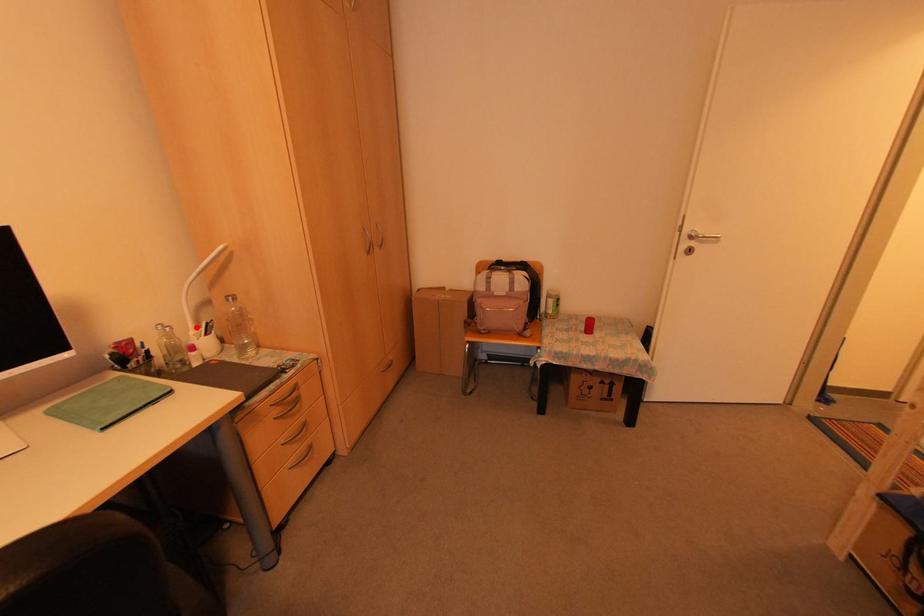
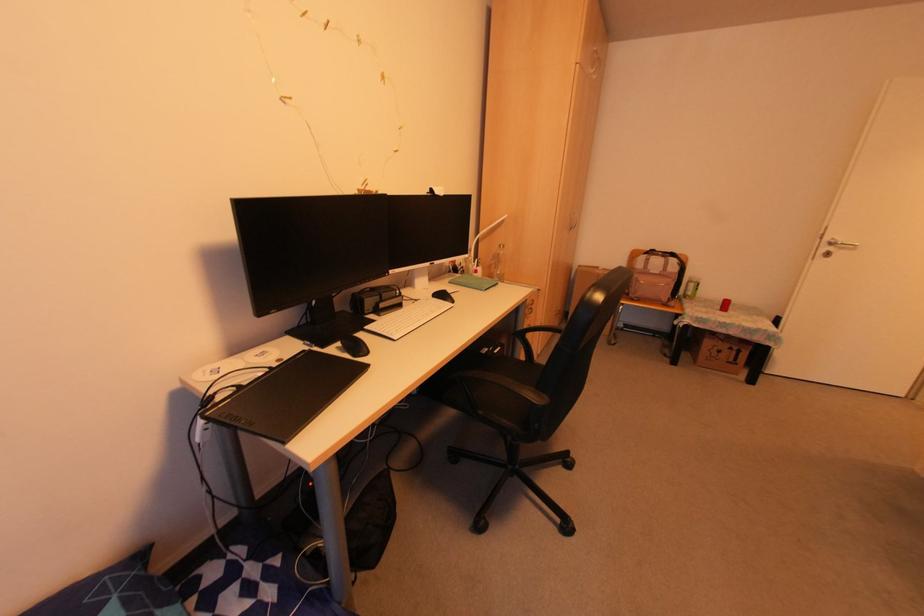
Where in the second image is the point corresponding to the highlighted location from the first image?

(472, 262)